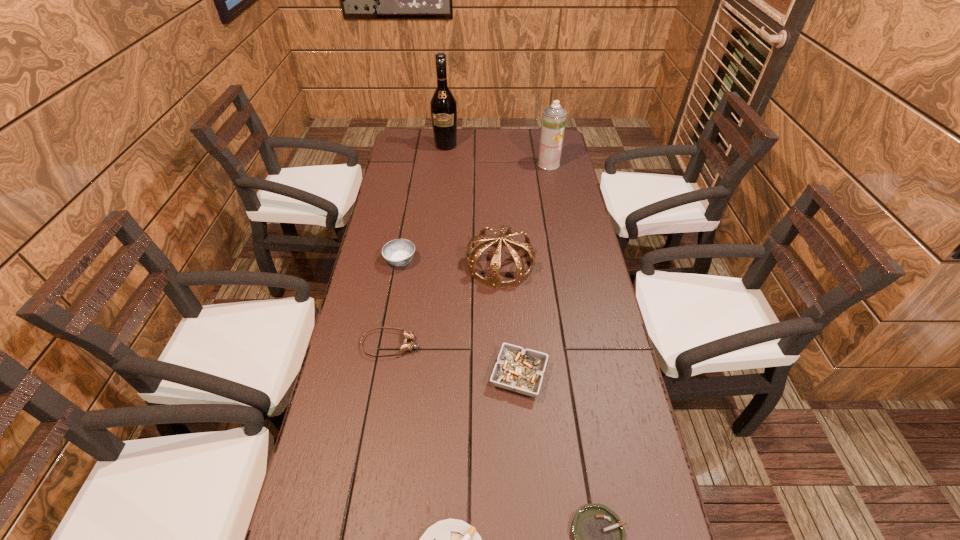
Identify the location of free location at the left edge. The width and height of the screenshot is (960, 540). (358, 307).

This screenshot has height=540, width=960. Identify the location of vacant position at the right edge of the desktop. (606, 320).

Where is `free space at the far left corner of the desktop`? The width and height of the screenshot is (960, 540). free space at the far left corner of the desktop is located at coordinates (395, 156).

I want to click on free space between the third nearest ashtray and the second farthest object, so click(x=534, y=270).

This screenshot has width=960, height=540. Find the location of `vacant point located between the third tallest object and the aerosol can`. vacant point located between the third tallest object and the aerosol can is located at coordinates (524, 214).

Locate an element on the screen. The image size is (960, 540). free space between the tallest object and the farthest ashtray is located at coordinates (423, 203).

Choose which object is the second nearest neighbor to the third ashtray from left to right. Please provide its 2D coordinates. Your answer should be formatted as a tuple, i.e. [(x, y)], where the tuple contains the x and y coordinates of a point satisfying the conditions above.

[(493, 279)]

Select which object appears as the fifth closest to the tallest ashtray. Please provide its 2D coordinates. Your answer should be formatted as a tuple, i.e. [(x, y)], where the tuple contains the x and y coordinates of a point satisfying the conditions above.

[(554, 117)]

Locate which ashtray is the second closest to the fourth tallest object. Please provide its 2D coordinates. Your answer should be formatted as a tuple, i.e. [(x, y)], where the tuple contains the x and y coordinates of a point satisfying the conditions above.

[(451, 539)]

Select which ashtray is the second closest to the tiara. Please provide its 2D coordinates. Your answer should be formatted as a tuple, i.e. [(x, y)], where the tuple contains the x and y coordinates of a point satisfying the conditions above.

[(520, 370)]